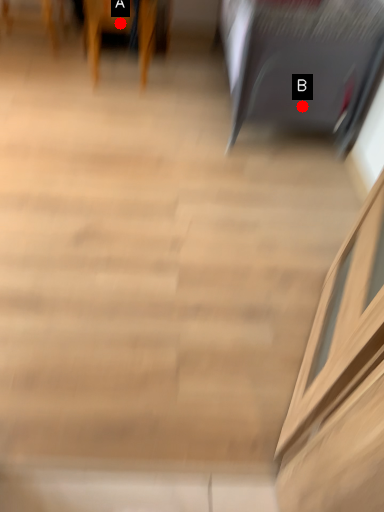
Question: Two points are circled on the image, labeled by A and B beside each circle. Which of the following is the farthest from the observer?

Choices:
 (A) A is further
 (B) B is further

Answer: (A)